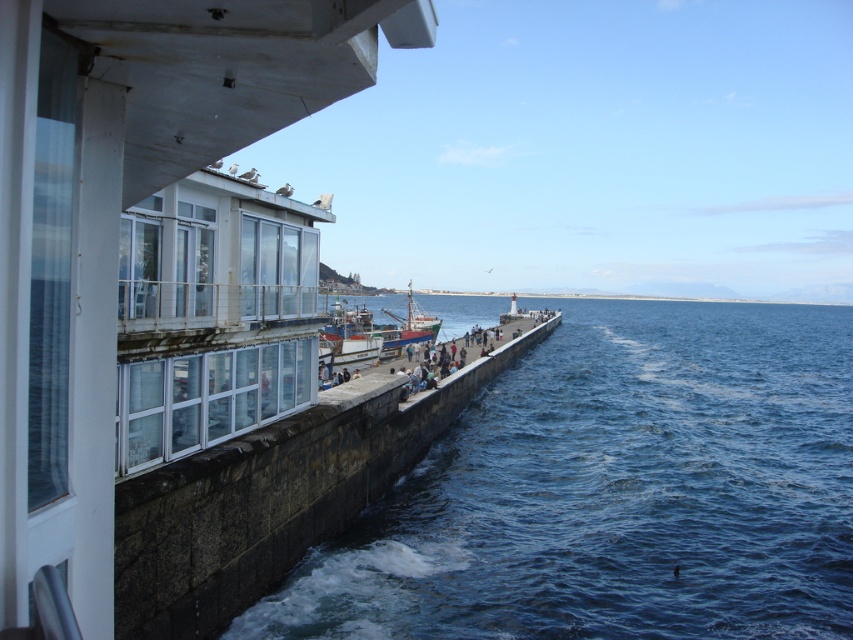
Is point (401, 344) closer to viewer compared to point (454, 358)?

No.

The image size is (853, 640). I want to click on wooden ship at center, so click(x=408, y=330).

Which of these two, blue water at center or wooden ship at center, stands taller?

With more height is wooden ship at center.

The width and height of the screenshot is (853, 640). I want to click on blue water at center, so click(x=614, y=492).

The height and width of the screenshot is (640, 853). What are the coordinates of `blue water at center` in the screenshot? It's located at [x=614, y=492].

Who is lower down, stone concrete ledge at center or wooden fishing boat at center?

stone concrete ledge at center

Is stone concrete ledge at center wider than wooden fishing boat at center?

In fact, stone concrete ledge at center might be narrower than wooden fishing boat at center.

Is point (317, 483) positioned before point (328, 337)?

Yes.

Find the location of a particular element. The image size is (853, 640). stone concrete ledge at center is located at coordinates (271, 499).